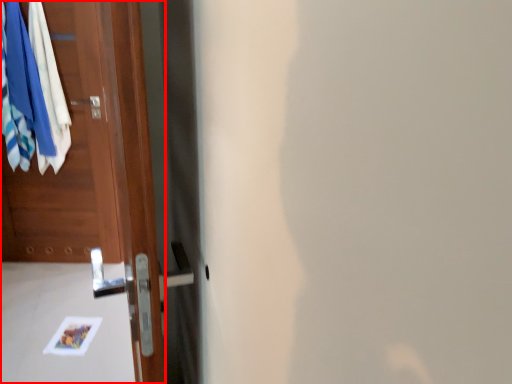
Question: From the image's perspective, where is door (annotated by the red box) located relative to clothing?

Choices:
 (A) above
 (B) below

Answer: (B)